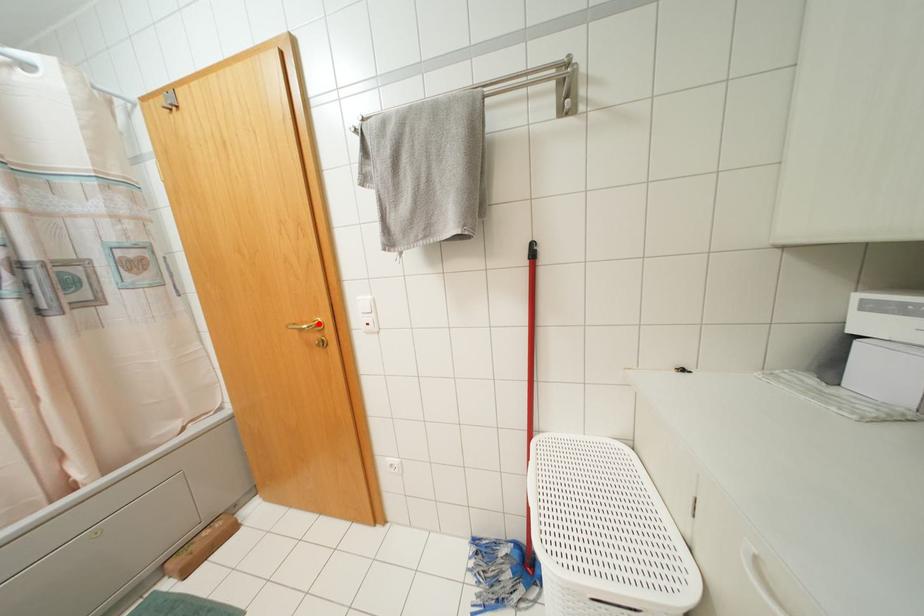
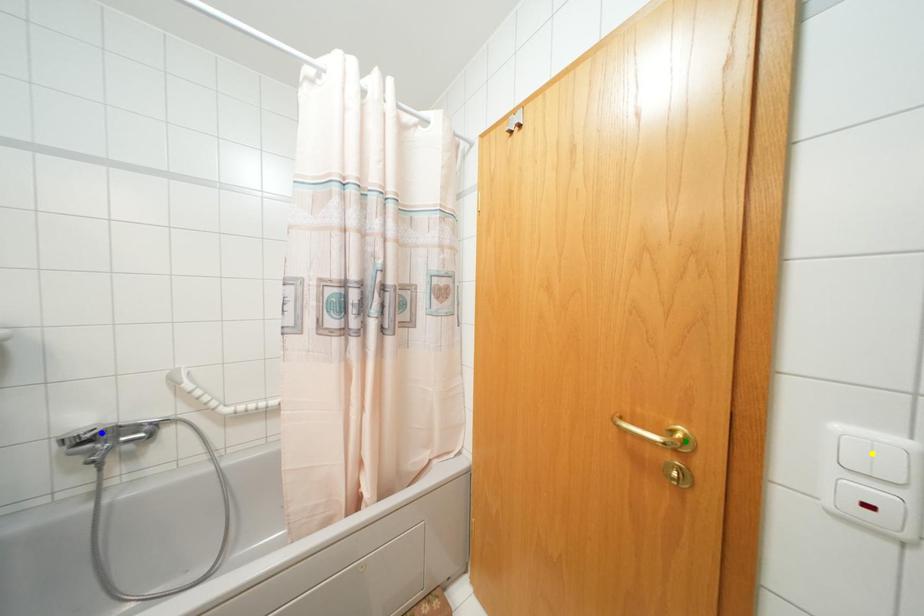
Question: I am providing you with two images of the same scene from different viewpoints. A red point is marked on the first image. You are given multiple points on the second image. Which spot in image 2 lines up with the point in image 1?

Choices:
 (A) green point
 (B) yellow point
 (C) blue point

Answer: (A)